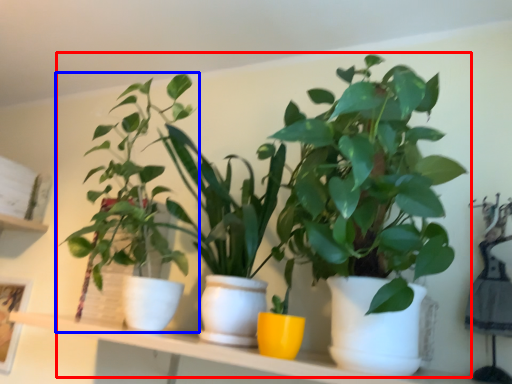
Question: Which of the following is the farthest to the observer, houseplant (highlighted by a red box) or houseplant (highlighted by a blue box)?

Choices:
 (A) houseplant
 (B) houseplant

Answer: (B)